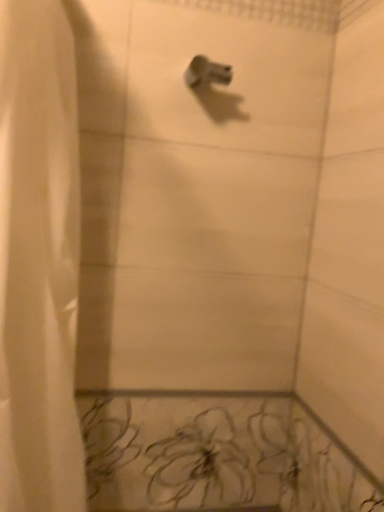
Describe the element at coordinates (207, 72) in the screenshot. The height and width of the screenshot is (512, 384). I see `matte gray showerhead at upper center` at that location.

You are a GUI agent. You are given a task and a screenshot of the screen. Output one action in this format:
    pyautogui.click(x=<x>, y=<y>)
    Task: Click on the matte gray showerhead at upper center
    This screenshot has height=512, width=384.
    Given the screenshot: What is the action you would take?
    pyautogui.click(x=207, y=72)

This screenshot has height=512, width=384. Find the location of `matte gray showerhead at upper center`. matte gray showerhead at upper center is located at coordinates (207, 72).